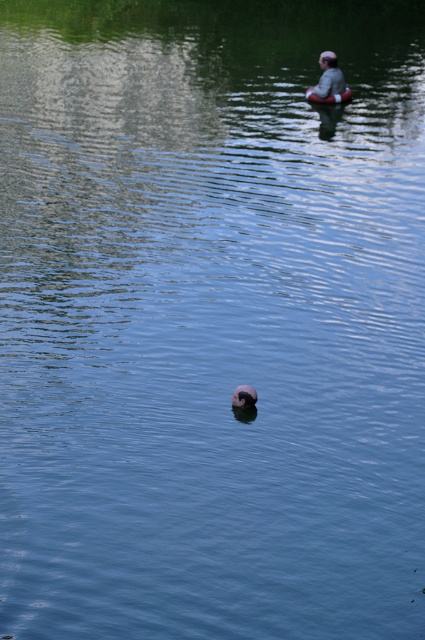
You are a GUI agent. You are given a task and a screenshot of the screen. Output one action in this format:
    pyautogui.click(x=<x>, y=<y>)
    Task: Click on the smooth plastic canoe at upper center
    The width and height of the screenshot is (425, 640).
    Given the screenshot: What is the action you would take?
    pyautogui.click(x=328, y=97)

Does smooth plastic canoe at upper center lie behind smooth pink rubber ring at upper center?

Yes, it is behind smooth pink rubber ring at upper center.

What do you see at coordinates (328, 97) in the screenshot? I see `smooth plastic canoe at upper center` at bounding box center [328, 97].

Identify the location of smooth plastic canoe at upper center. (328, 97).

Does light gray fabric person at upper center appear on the left side of smooth pink rubber ring at upper center?

In fact, light gray fabric person at upper center is to the right of smooth pink rubber ring at upper center.

Between point (331, 74) and point (249, 404), which one is positioned in front?

Point (249, 404) is in front.

Describe the element at coordinates (328, 77) in the screenshot. Image resolution: width=425 pixels, height=640 pixels. I see `light gray fabric person at upper center` at that location.

Locate an element on the screen. Image resolution: width=425 pixels, height=640 pixels. light gray fabric person at upper center is located at coordinates (328, 77).

Between point (334, 68) and point (342, 100), which one is positioned in front?

Positioned in front is point (342, 100).

In the scene shown: Which is above, light gray fabric person at upper center or smooth plastic canoe at upper center?

light gray fabric person at upper center is above.

Does point (325, 76) come behind point (333, 93)?

Yes, it is behind point (333, 93).

This screenshot has width=425, height=640. I want to click on light gray fabric person at upper center, so click(x=328, y=77).